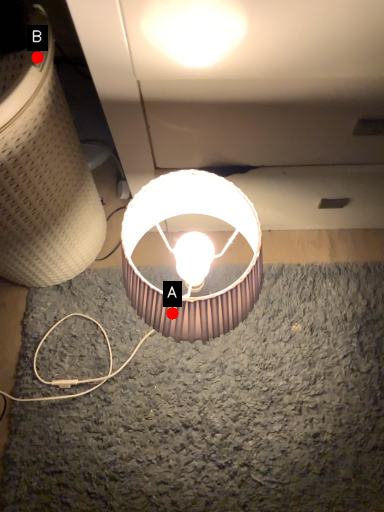
Question: Two points are circled on the image, labeled by A and B beside each circle. Which point is closer to the camera?

Choices:
 (A) A is closer
 (B) B is closer

Answer: (B)